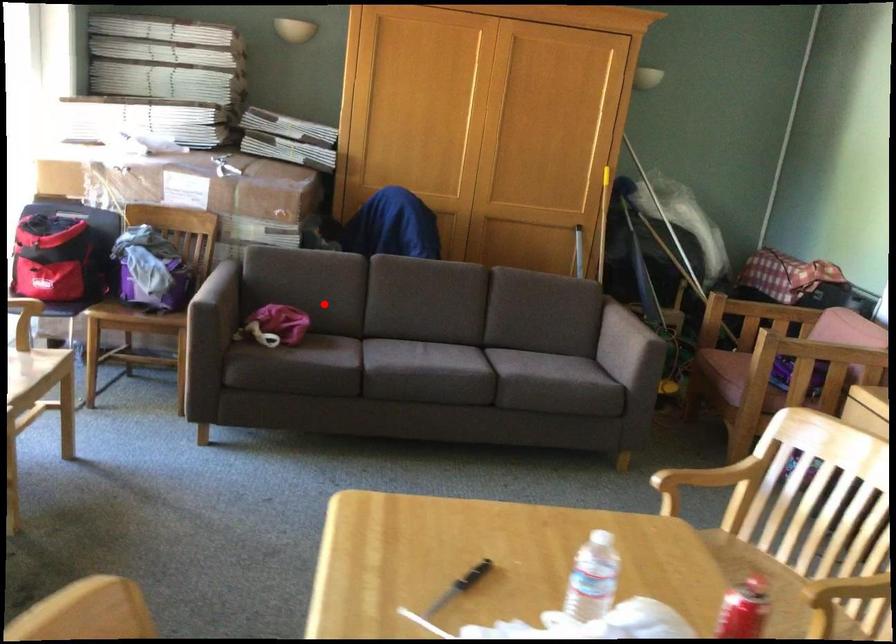
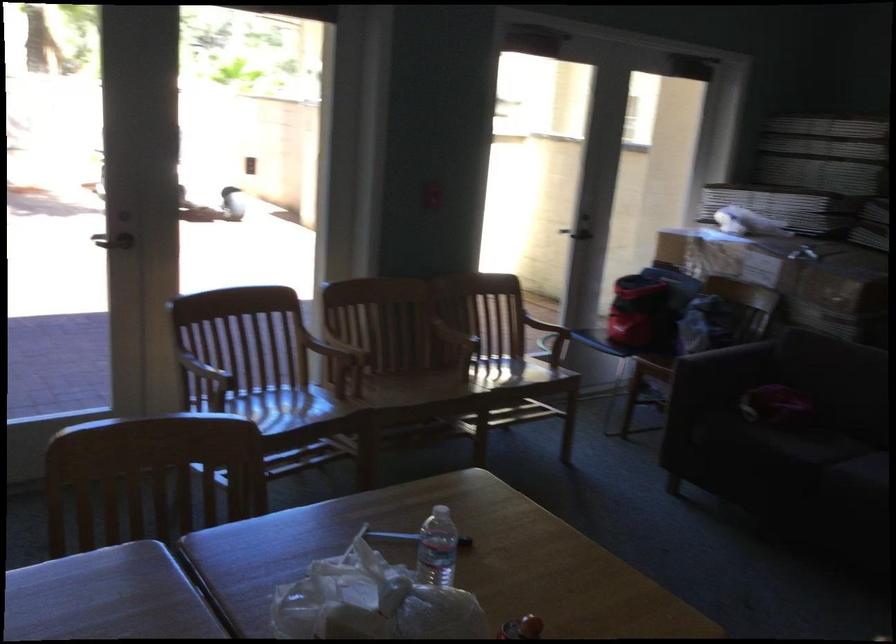
Question: A red point is marked in image1. In image2, is the corresponding 3D point closer to the camera or farther? Reply with the corresponding letter.

Choices:
 (A) The corresponding 3D point is closer.
 (B) The corresponding 3D point is farther.

Answer: (A)